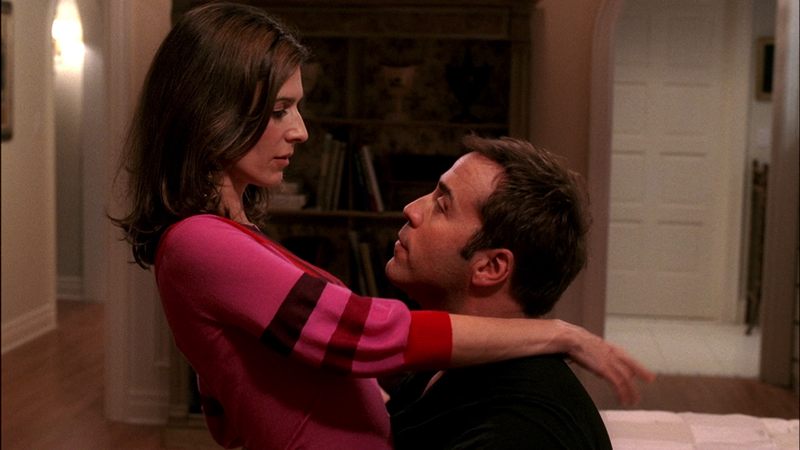
The width and height of the screenshot is (800, 450). I want to click on door, so click(x=660, y=180).